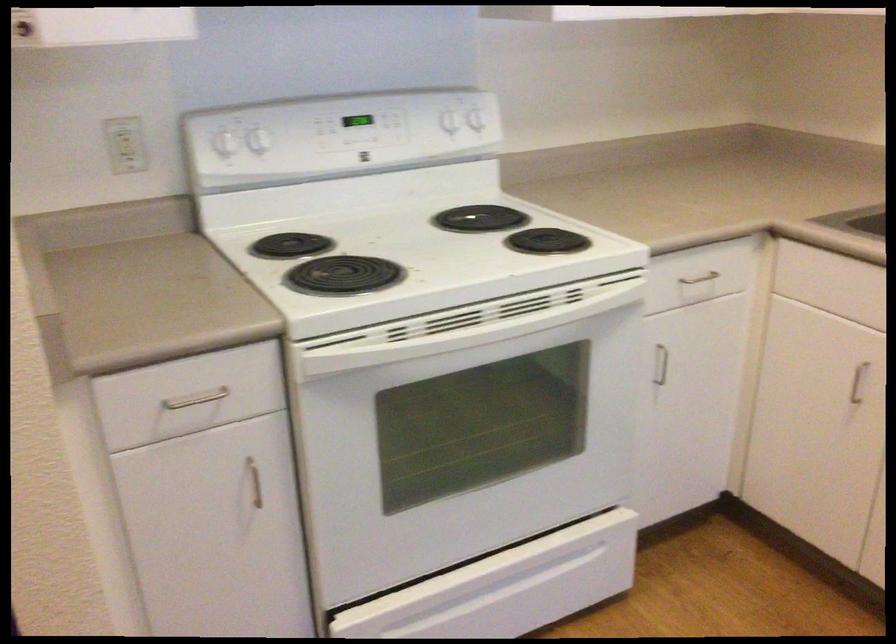
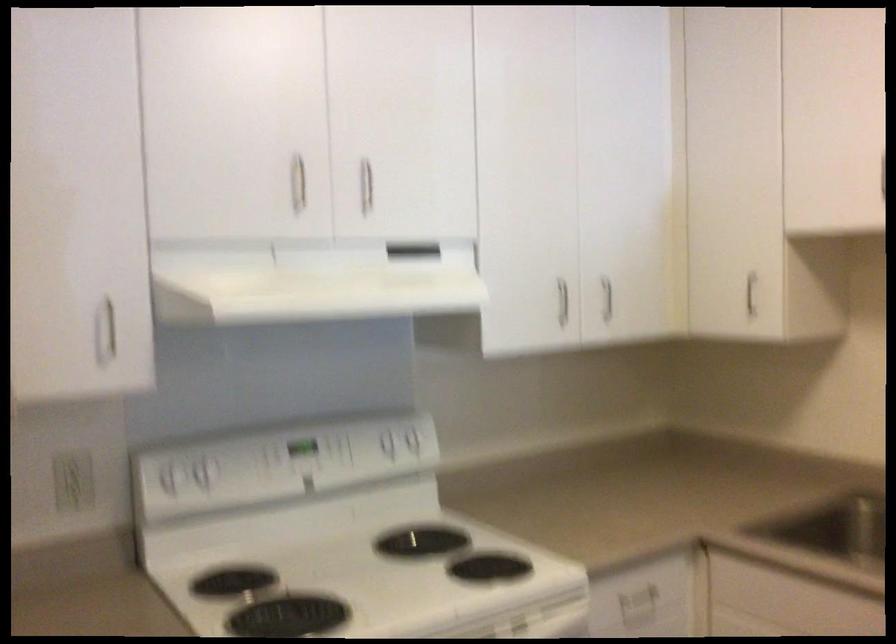
The point at (259, 140) is marked in the first image. Where is the corresponding point in the second image?

(200, 474)